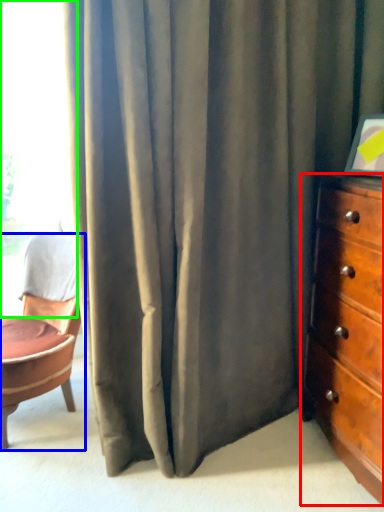
Question: Considering the real-world distances, which object is closest to chest of drawers (highlighted by a red box)? chair (highlighted by a blue box) or window (highlighted by a green box).

Choices:
 (A) chair
 (B) window

Answer: (A)